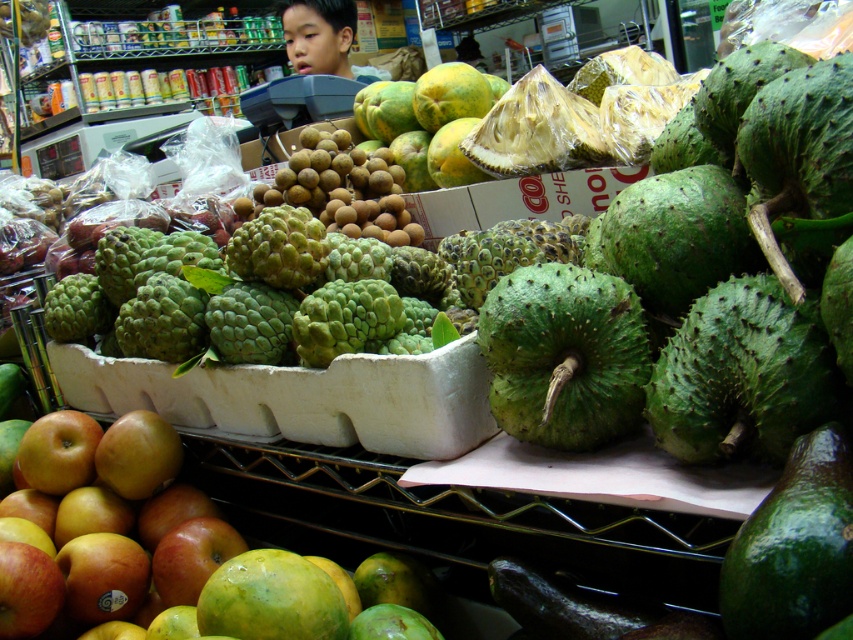
You are a customer at the fruit market and want to place both the green spiky fruit at center and the smooth skin boy at upper center into a single shopping bag. Based on their sizes, which fruit should you place first into the bag?

The green spiky fruit at center has a lesser width compared to the smooth skin boy at upper center. Therefore, you should place the smooth skin boy at upper center first into the bag to accommodate its larger size, followed by the smaller green spiky fruit at center.